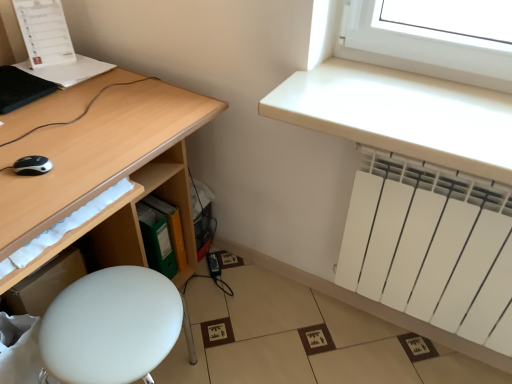
You are a GUI agent. You are given a task and a screenshot of the screen. Output one action in this format:
    pyautogui.click(x=<x>, y=<y>)
    Task: Click on the free space above white matte stool at lower left (from a real-world perspective)
    This screenshot has width=512, height=384.
    Given the screenshot: What is the action you would take?
    pyautogui.click(x=111, y=323)